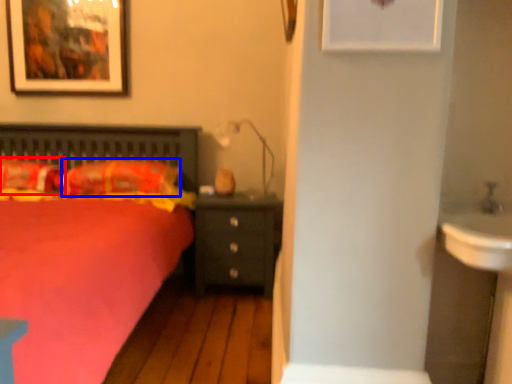
Question: Which of the following is the closest to the observer, pillow (highlighted by a red box) or pillow (highlighted by a blue box)?

Choices:
 (A) pillow
 (B) pillow

Answer: (A)